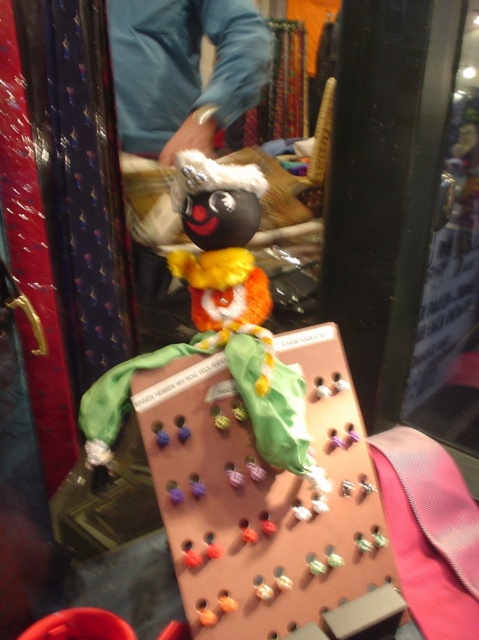
Question: Which of the following is the closest to the observer?

Choices:
 (A) blue fabric at upper center
 (B) transparent glass at center

Answer: (B)

Question: Does transparent glass at center have a smaller size compared to blue fabric at upper center?

Choices:
 (A) no
 (B) yes

Answer: (A)

Question: Is transparent glass at center to the left of blue fabric at upper center from the viewer's perspective?

Choices:
 (A) no
 (B) yes

Answer: (A)

Question: Is transparent glass at center positioned in front of blue fabric at upper center?

Choices:
 (A) yes
 (B) no

Answer: (A)

Question: Which point is closer to the camera?

Choices:
 (A) (255, 42)
 (B) (444, 54)

Answer: (B)